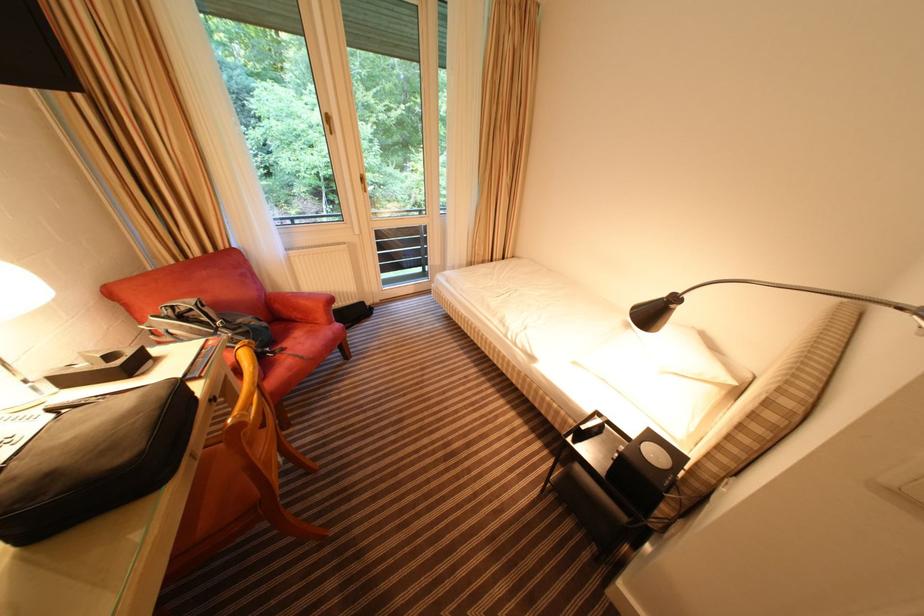
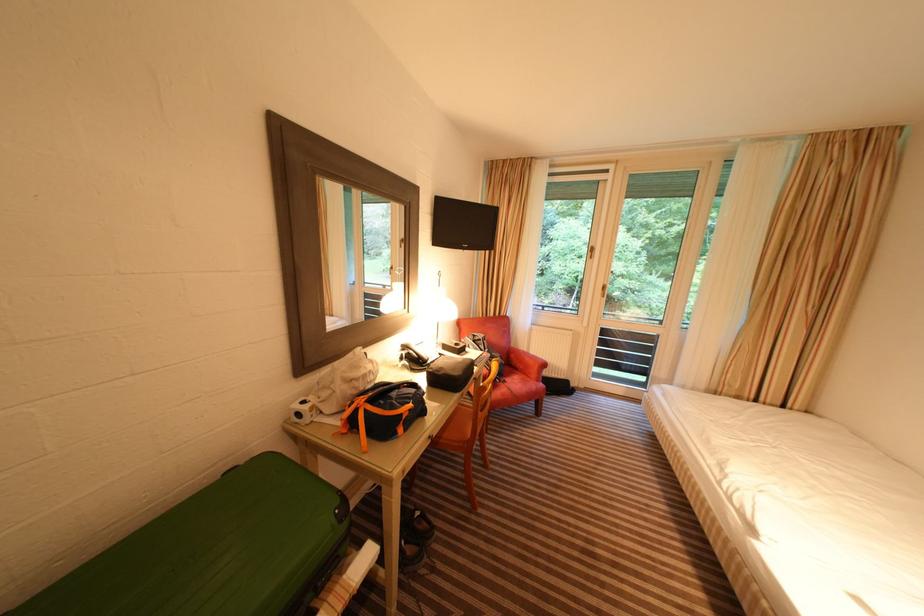
Locate, in the second image, the point that corresponds to point (289, 352) in the first image.

(512, 384)